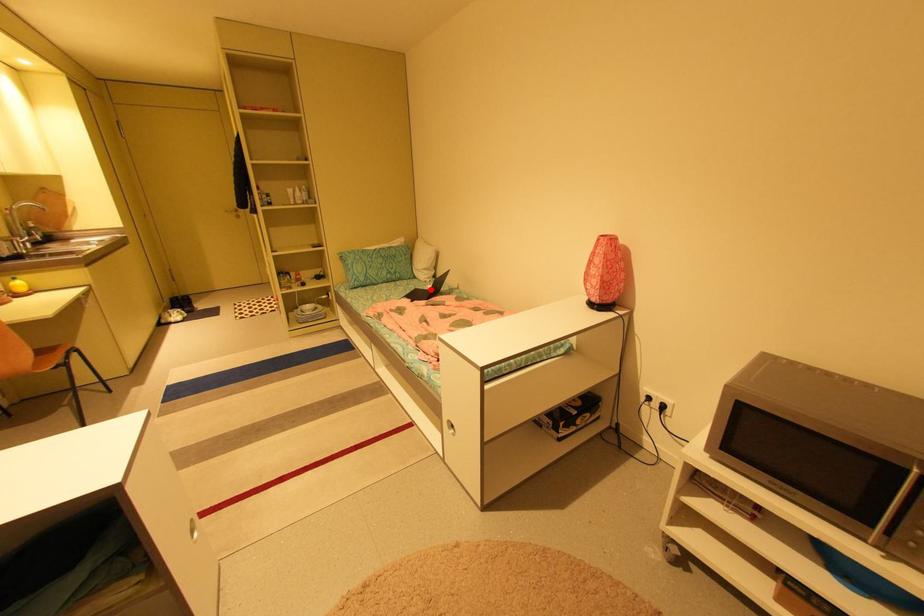
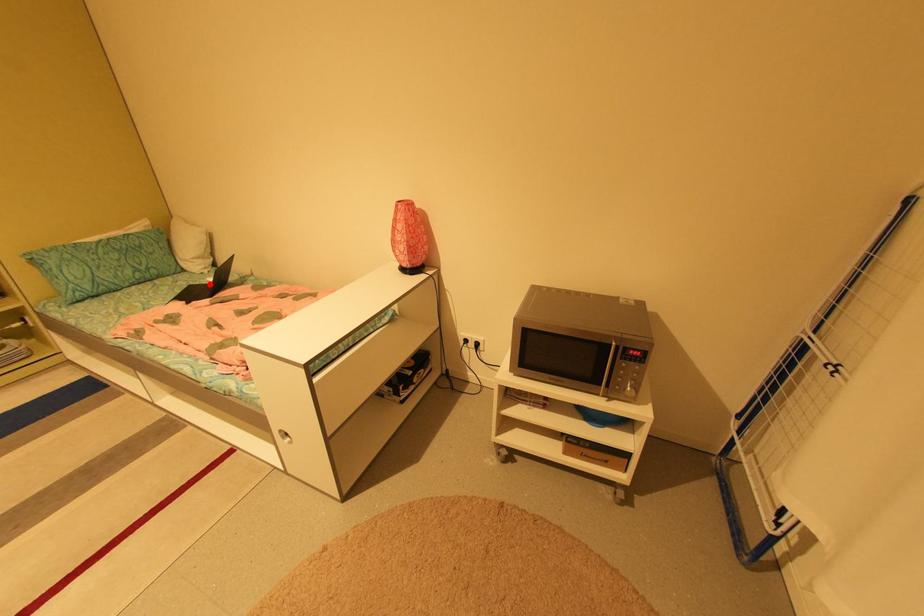
I am providing you with two images of the same scene from different viewpoints. A red point is marked on the first image and another point is marked on the second image. Do the highlighted points in image1 and image2 indicate the same real-world spot?

Yes